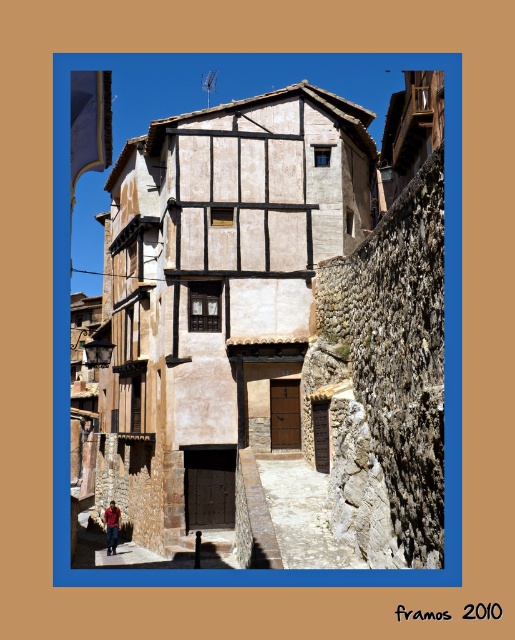
In the scene shown: You are an architect analyzing the spatial layout of the scene. Given the brown wooden house at center and the red cotton shirt at lower left, which object occupies a larger horizontal space in the image?

The brown wooden house at center occupies a larger horizontal space than the red cotton shirt at lower left because its width surpasses the shirt.